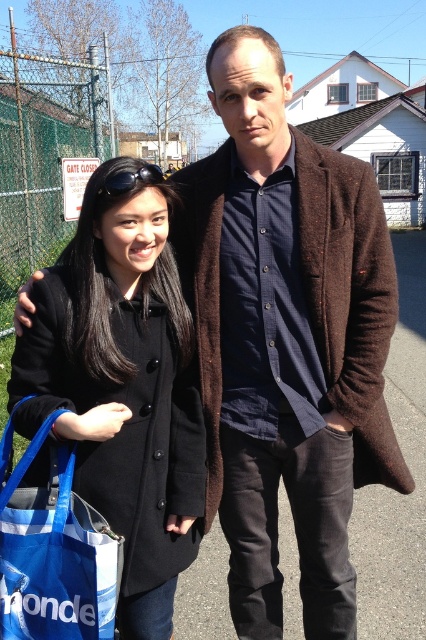
Question: Is black wool coat at left wider than blue fabric bag at lower left?

Choices:
 (A) yes
 (B) no

Answer: (A)

Question: Is black wool coat at left to the right of blue fabric bag at lower left from the viewer's perspective?

Choices:
 (A) yes
 (B) no

Answer: (A)

Question: Which point appears farthest from the camera in this image?

Choices:
 (A) (77, 545)
 (B) (71, 404)

Answer: (B)

Question: Which of the following is the farthest from the observer?

Choices:
 (A) (20, 572)
 (B) (34, 362)

Answer: (B)

Question: Considering the relative positions of black wool coat at left and blue fabric bag at lower left in the image provided, where is black wool coat at left located with respect to blue fabric bag at lower left?

Choices:
 (A) below
 (B) above

Answer: (B)